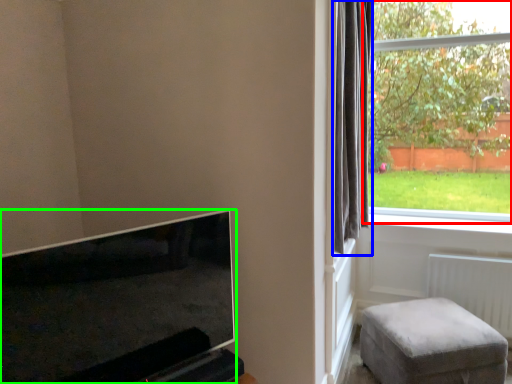
Question: Which object is the closest to the window (highlighted by a red box)? Choose among these: curtain (highlighted by a blue box) or television (highlighted by a green box).

Choices:
 (A) curtain
 (B) television

Answer: (A)